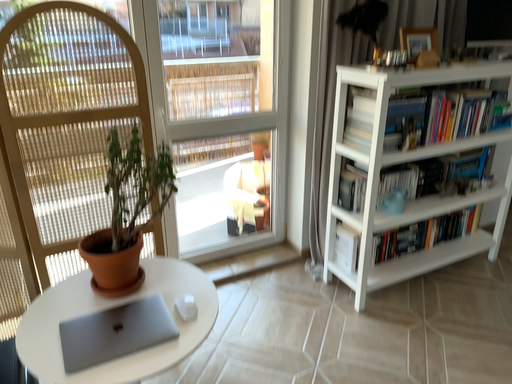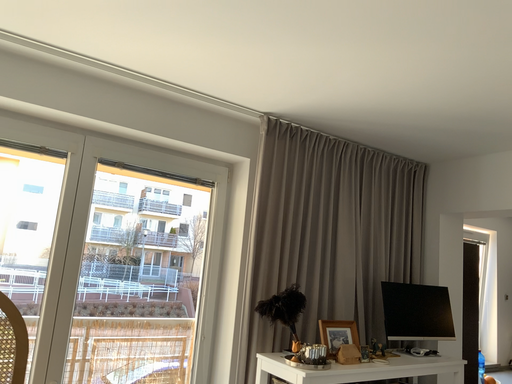
Question: Which way did the camera rotate in the video?

Choices:
 (A) rotated downward
 (B) rotated upward

Answer: (B)